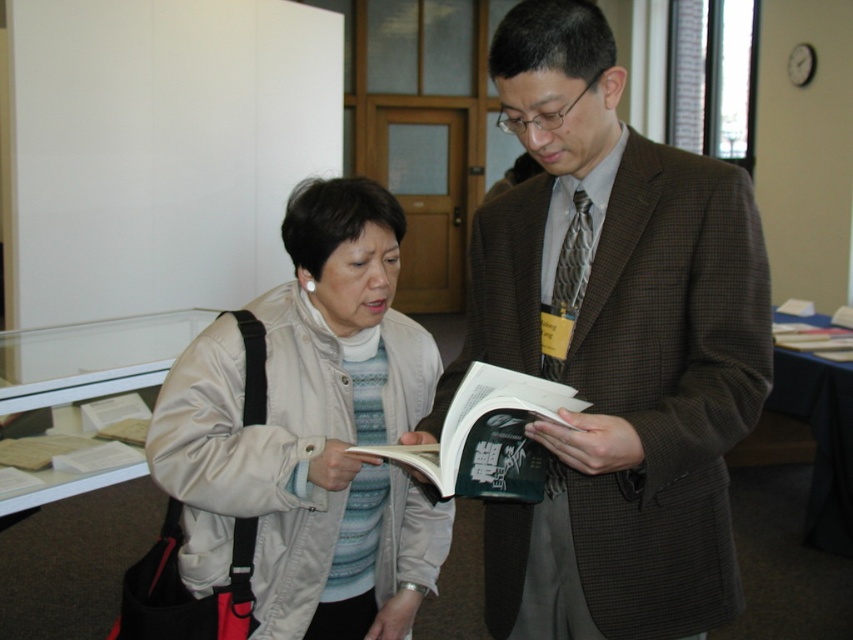
Where is `beige satin jacket at center`? The height and width of the screenshot is (640, 853). beige satin jacket at center is located at coordinates (311, 433).

Can you confirm if beige satin jacket at center is positioned to the left of green matte book at center?

Correct, you'll find beige satin jacket at center to the left of green matte book at center.

Locate an element on the screen. The width and height of the screenshot is (853, 640). beige satin jacket at center is located at coordinates (311, 433).

Who is positioned more to the left, brown checkered suit at center or beige satin jacket at center?

beige satin jacket at center

Is point (630, 426) less distant than point (354, 321)?

Yes, it is.

Between point (572, 525) and point (437, 364), which one is positioned behind?

The point (437, 364) is behind.

The width and height of the screenshot is (853, 640). What are the coordinates of `brown checkered suit at center` in the screenshot? It's located at (613, 348).

Who is positioned more to the left, brown checkered suit at center or green matte book at center?

green matte book at center is more to the left.

Can you confirm if brown checkered suit at center is positioned to the right of green matte book at center?

Correct, you'll find brown checkered suit at center to the right of green matte book at center.

Which is in front, point (581, 230) or point (494, 365)?

Point (494, 365) is in front.

In order to click on brown checkered suit at center in this screenshot , I will do `click(613, 348)`.